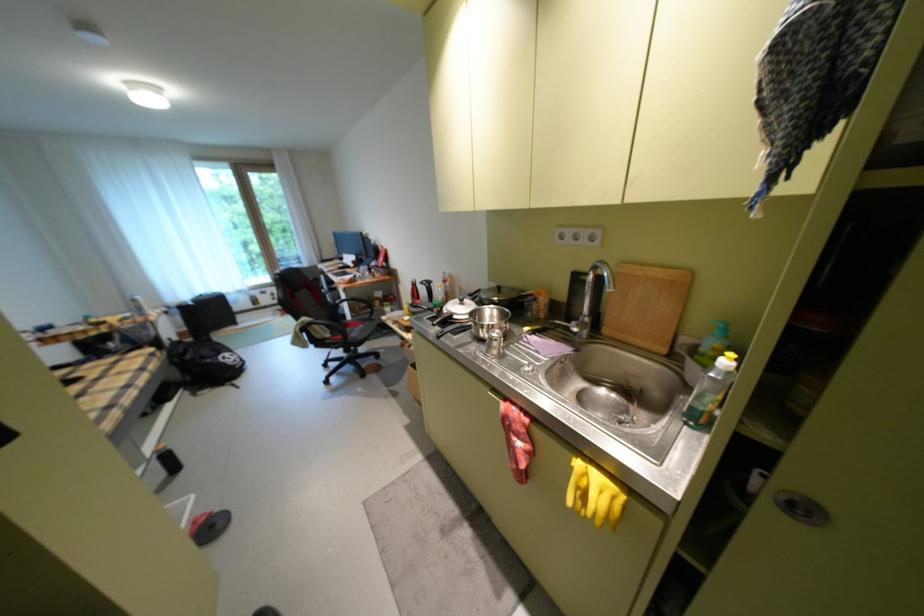
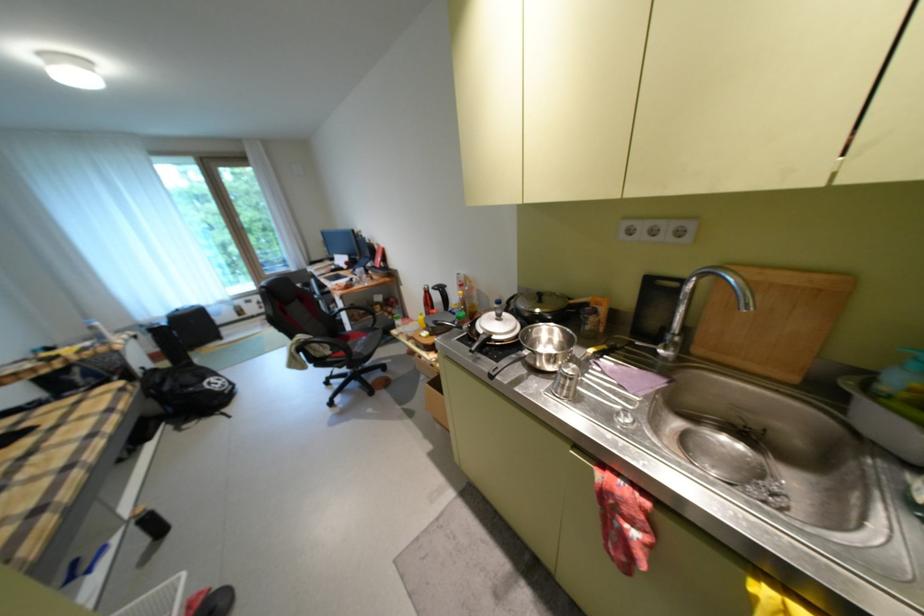
Question: Based on the continuous images, in which direction is the camera rotating? Reply with the corresponding letter.

Choices:
 (A) Left
 (B) Right
 (C) Up
 (D) Down

Answer: (D)